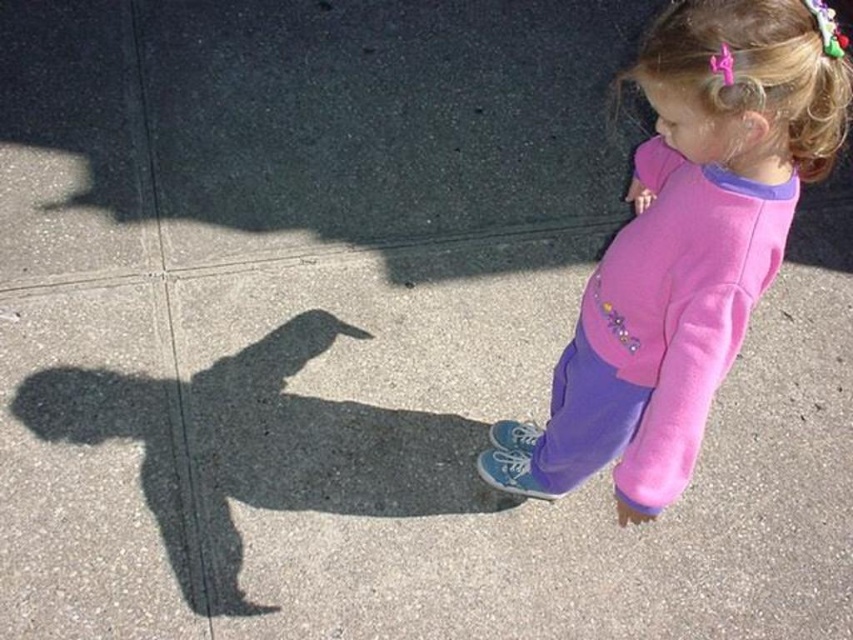
Question: Is pink fleece sweatshirt at center to the left of pink hair clip at upper right from the viewer's perspective?

Choices:
 (A) yes
 (B) no

Answer: (A)

Question: Does pink fleece sweatshirt at center have a smaller size compared to pink hair clip at upper right?

Choices:
 (A) no
 (B) yes

Answer: (A)

Question: Is pink fleece sweatshirt at center above pink hair clip at upper right?

Choices:
 (A) yes
 (B) no

Answer: (B)

Question: Which point is closer to the camera?

Choices:
 (A) pink fleece sweatshirt at center
 (B) pink hair clip at upper right

Answer: (B)